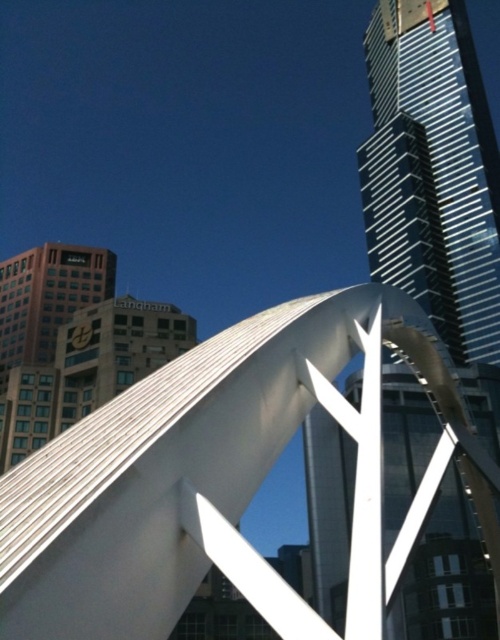
Question: Which point is farther to the camera?

Choices:
 (A) pos(218,557)
 (B) pos(375,253)

Answer: (B)

Question: Does white polished metal sculpture at center lie behind polished glass skyscraper at center?

Choices:
 (A) no
 (B) yes

Answer: (A)

Question: Which point is closer to the camera taking this photo?

Choices:
 (A) (444, 273)
 (B) (432, 362)

Answer: (B)

Question: Does white polished metal sculpture at center appear on the right side of polished glass skyscraper at center?

Choices:
 (A) yes
 (B) no

Answer: (B)

Question: Does white polished metal sculpture at center appear on the left side of polished glass skyscraper at center?

Choices:
 (A) no
 (B) yes

Answer: (B)